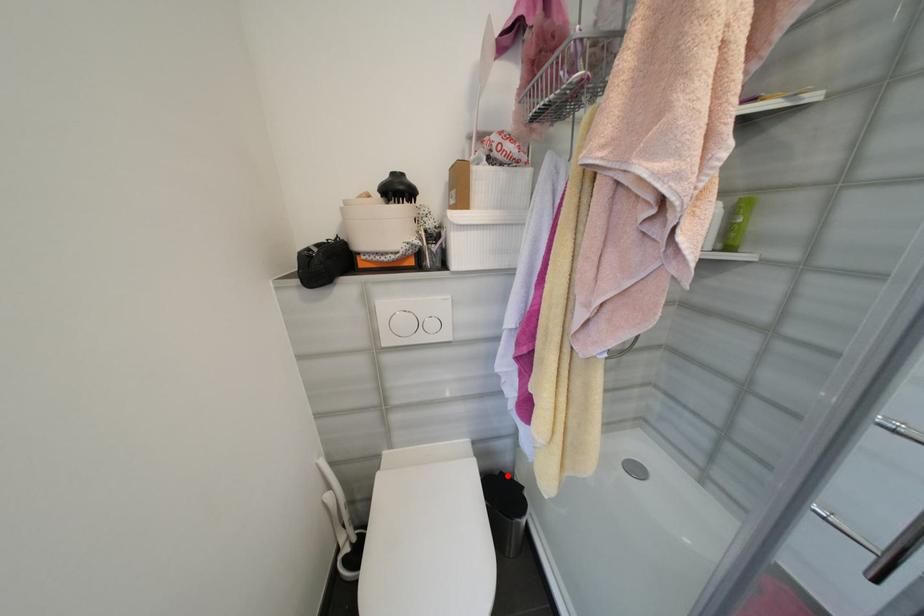
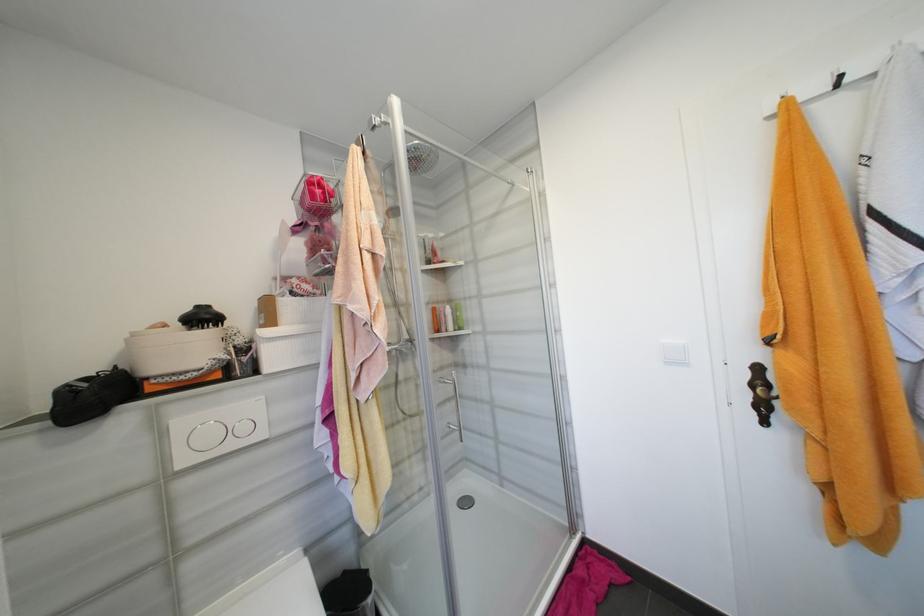
Question: I am providing you with two images of the same scene from different viewpoints. In image1, a red point is highlighted. Considering the same 3D point in image2, which of the following is correct?

Choices:
 (A) It is closer
 (B) It is farther

Answer: (A)